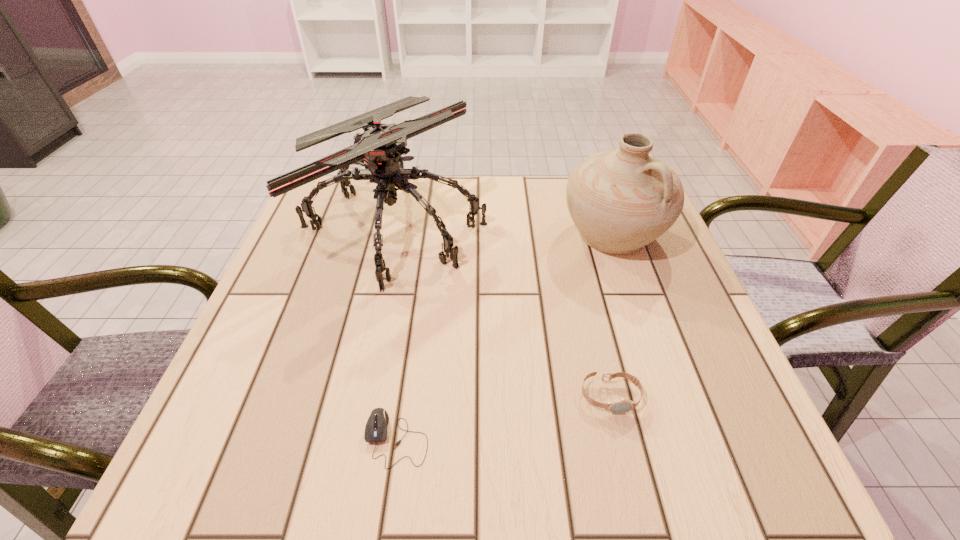
I want to click on drone, so click(x=379, y=149).

Find the location of a particular element. pottery is located at coordinates (620, 200).

At what (x,y) coordinates should I click in order to perform the action: click on the second shortest object. Please return your answer as a coordinate pair (x, y). The width and height of the screenshot is (960, 540). Looking at the image, I should click on click(x=622, y=405).

Find the location of a particular element. The height and width of the screenshot is (540, 960). the shortest object is located at coordinates (376, 427).

This screenshot has width=960, height=540. Find the location of `free location located on the right of the drone`. free location located on the right of the drone is located at coordinates (548, 226).

You are a GUI agent. You are given a task and a screenshot of the screen. Output one action in this format:
    pyautogui.click(x=<x>, y=<y>)
    Task: Click on the vacant space located on the front of the pottery
    The height and width of the screenshot is (540, 960).
    Given the screenshot: What is the action you would take?
    pyautogui.click(x=637, y=303)

Locate an element on the screen. free space located 0.080m on the face of the third tallest object is located at coordinates (626, 463).

This screenshot has width=960, height=540. I want to click on vacant space located on the back of the shortest object, so click(418, 289).

Find the location of a particular element. This screenshot has width=960, height=540. drone situated at the far edge is located at coordinates (379, 149).

Identify the location of pottery that is at the far edge. (620, 200).